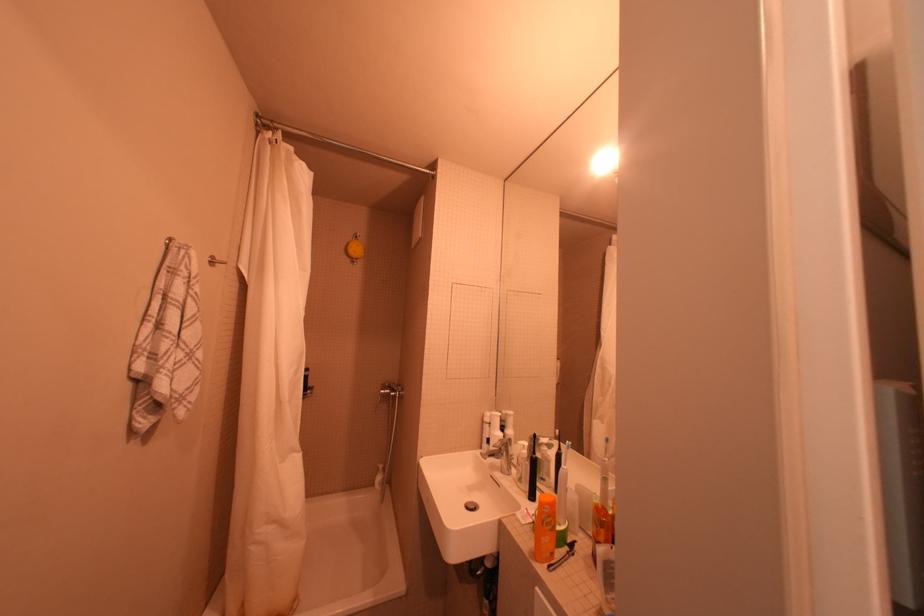
This screenshot has width=924, height=616. Find the location of `white shower curtain`. white shower curtain is located at coordinates (271, 387).